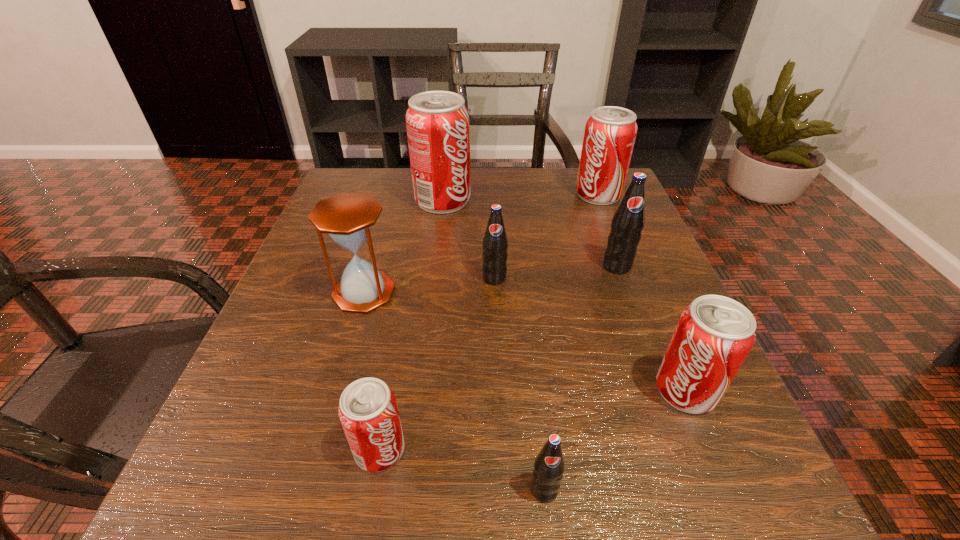
I want to click on object positioned at the left edge, so click(x=347, y=218).

Find the location of a particular element. Image resolution: width=960 pixels, height=540 pixels. object that is positioned at the far right corner is located at coordinates (610, 132).

Where is `vacant space at the far edge of the desktop`? vacant space at the far edge of the desktop is located at coordinates (464, 210).

The width and height of the screenshot is (960, 540). In the image, there is a desktop. In order to click on vacant space at the near edge in this screenshot , I will do [582, 468].

In the image, there is a desktop. Where is `vacant region at the left edge`? Image resolution: width=960 pixels, height=540 pixels. vacant region at the left edge is located at coordinates (331, 385).

This screenshot has width=960, height=540. In the image, there is a desktop. Find the location of `vacant space at the right edge`. vacant space at the right edge is located at coordinates (661, 258).

I want to click on vacant space at the far left corner of the desktop, so click(346, 190).

Locate an element on the screen. The height and width of the screenshot is (540, 960). vacant region between the second nearest pop and the second biggest red soda can is located at coordinates (489, 322).

Where is `vacant area that lies between the fourth object from left to right and the hourglass`? vacant area that lies between the fourth object from left to right and the hourglass is located at coordinates (429, 285).

At what (x,y) coordinates should I click in order to perform the action: click on free area in between the rightmost black pop and the fourth object from left to right. Please return your answer as a coordinate pair (x, y). The image size is (960, 540). Looking at the image, I should click on (556, 272).